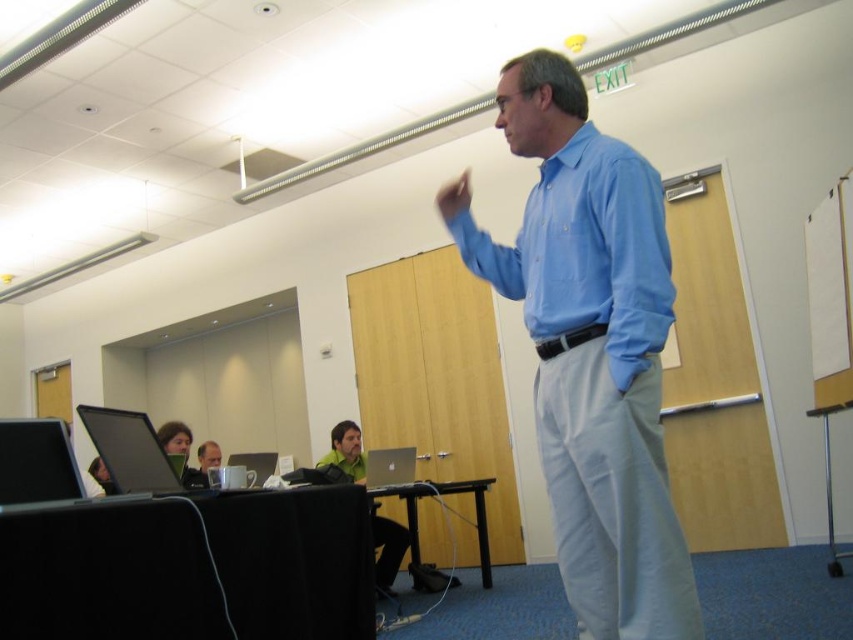
Question: Considering the real-world distances, which object is farthest from the matte black laptop at left?

Choices:
 (A) matte black laptop at center
 (B) green matte shirt at center

Answer: (B)

Question: Does green matte shirt at center appear under matte silver laptop at center?

Choices:
 (A) no
 (B) yes

Answer: (B)

Question: Which point is farther to the camera?

Choices:
 (A) silver metallic laptop at center
 (B) green matte shirt at center
 (C) blue cotton shirt at center
 (D) green fabric shirt at center

Answer: (B)

Question: Which object appears closest to the camera in this image?

Choices:
 (A) blue smooth shirt at center
 (B) matte black laptop at left
 (C) green matte shirt at center
 (D) silver metallic laptop at center

Answer: (A)

Question: Can you confirm if blue cotton shirt at center is positioned below matte black laptop at center?

Choices:
 (A) no
 (B) yes

Answer: (A)

Question: Does green matte shirt at center appear on the right side of green fabric shirt at center?

Choices:
 (A) no
 (B) yes

Answer: (B)